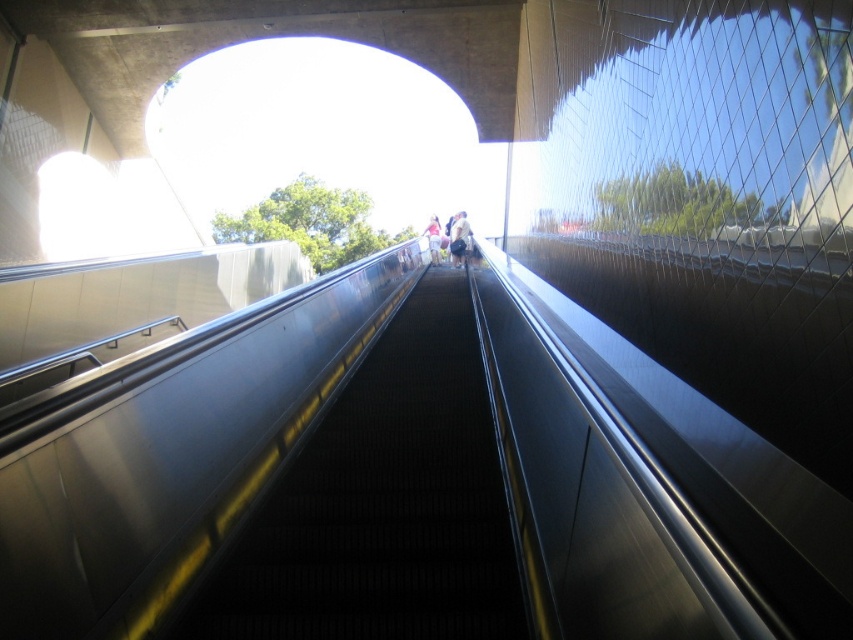
You are standing at the bottom of the escalator and want to reach the top. You notice two points marked on the escalator steps. Which point, point (x=431, y=541) or point (x=462, y=227), is closer to you as you look up the escalator?

Point (x=431, y=541) is closer to the viewer than point (x=462, y=227).

You are carrying a light beige fabric bag at center and a pink fabric at center while standing on an escalator. Which item do you need to adjust to ensure both fit comfortably on the escalator steps?

The light beige fabric bag at center is smaller than the pink fabric at center, so you may need to adjust the larger pink fabric at center to ensure it fits comfortably on the escalator steps.